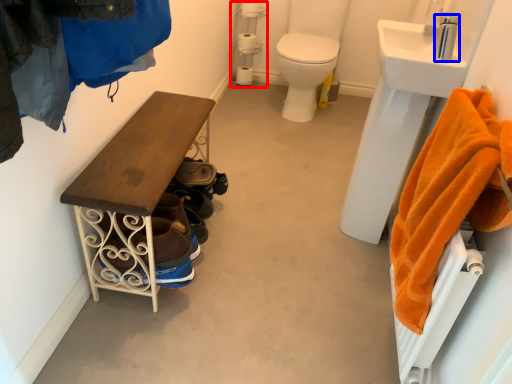
Question: Which of the following is the closest to the observer, shelf (highlighted by a red box) or faucet (highlighted by a blue box)?

Choices:
 (A) shelf
 (B) faucet

Answer: (B)